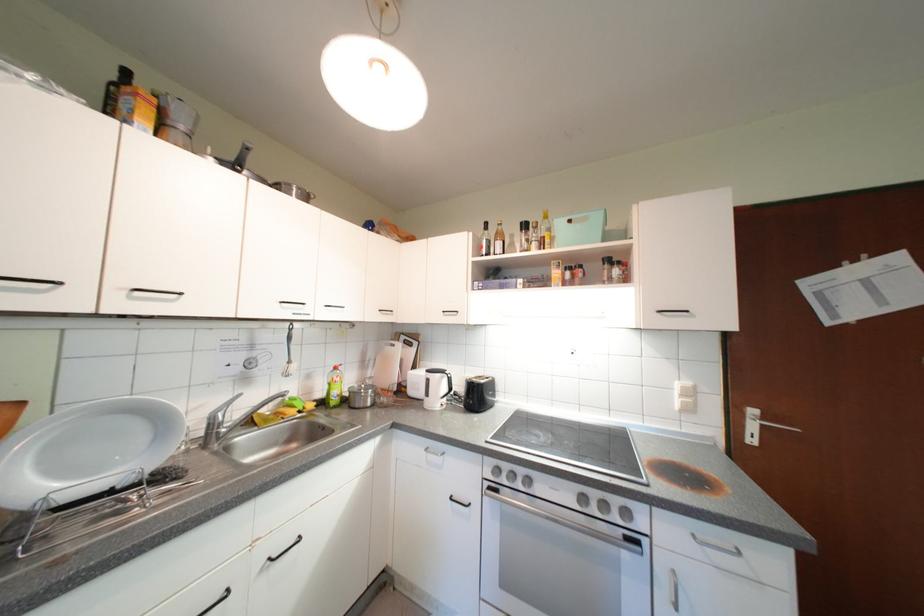
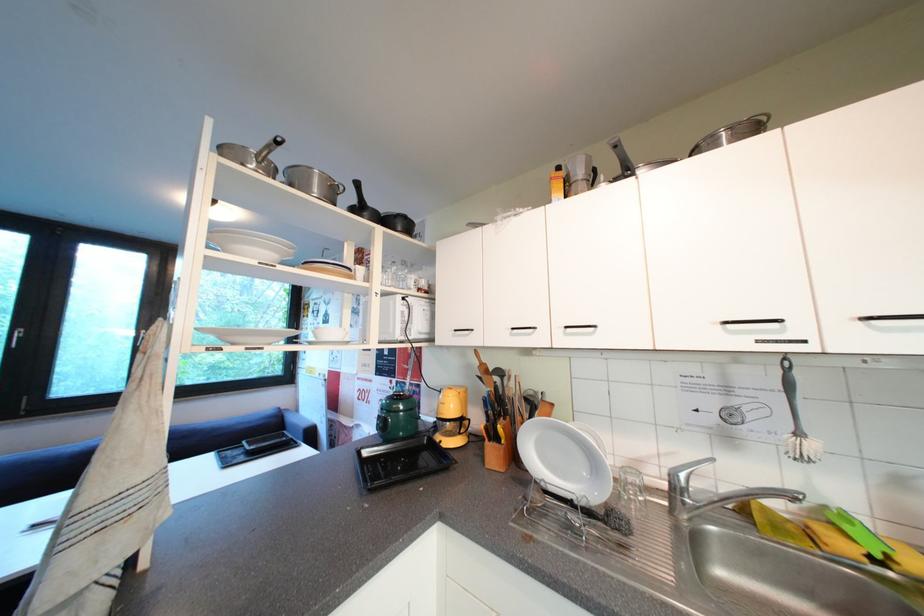
Question: Based on the continuous images, in which direction is the camera rotating? Reply with the corresponding letter.

Choices:
 (A) Left
 (B) Right
 (C) Up
 (D) Down

Answer: (A)